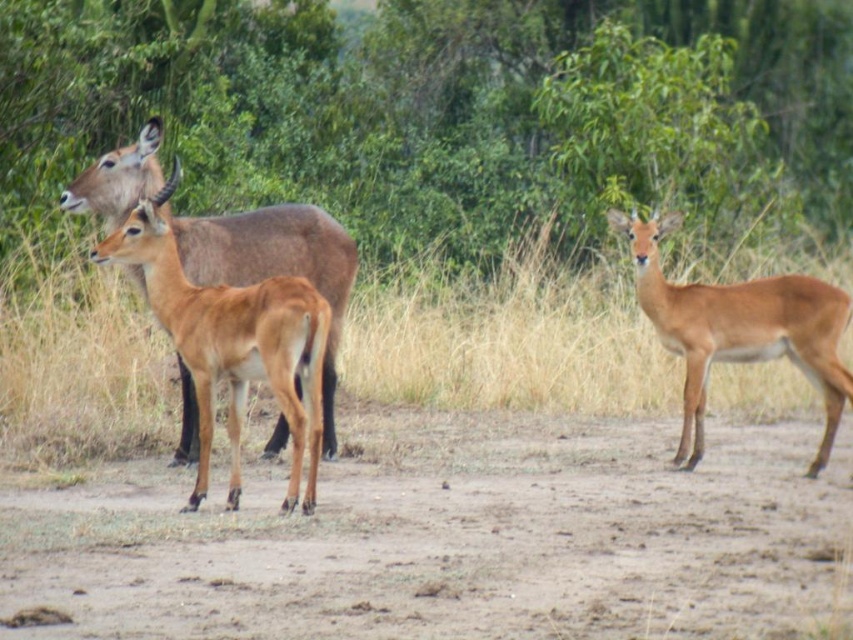
Question: Which object appears farthest from the camera in this image?

Choices:
 (A) brown matte/deer at right
 (B) brown grass at center

Answer: (B)

Question: Which object appears farthest from the camera in this image?

Choices:
 (A) brown matte antelope at left
 (B) brown grass at center
 (C) green leafy tree at upper center
 (D) brown matte/deer at right

Answer: (C)

Question: Does green leafy tree at upper center appear on the left side of brown matte/deer at right?

Choices:
 (A) no
 (B) yes

Answer: (B)

Question: Which of the following is the farthest from the observer?

Choices:
 (A) brown matte antelope at left
 (B) brown grass at center

Answer: (B)

Question: Does green leafy tree at upper center appear over brown matte antelope at left?

Choices:
 (A) yes
 (B) no

Answer: (A)

Question: Can you confirm if green leafy tree at upper center is thinner than brown grass at center?

Choices:
 (A) no
 (B) yes

Answer: (A)